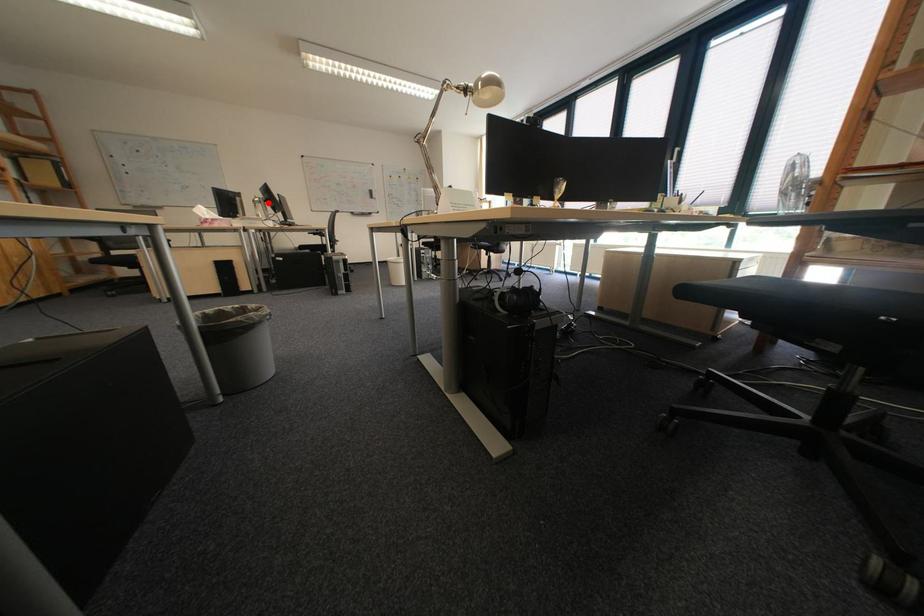
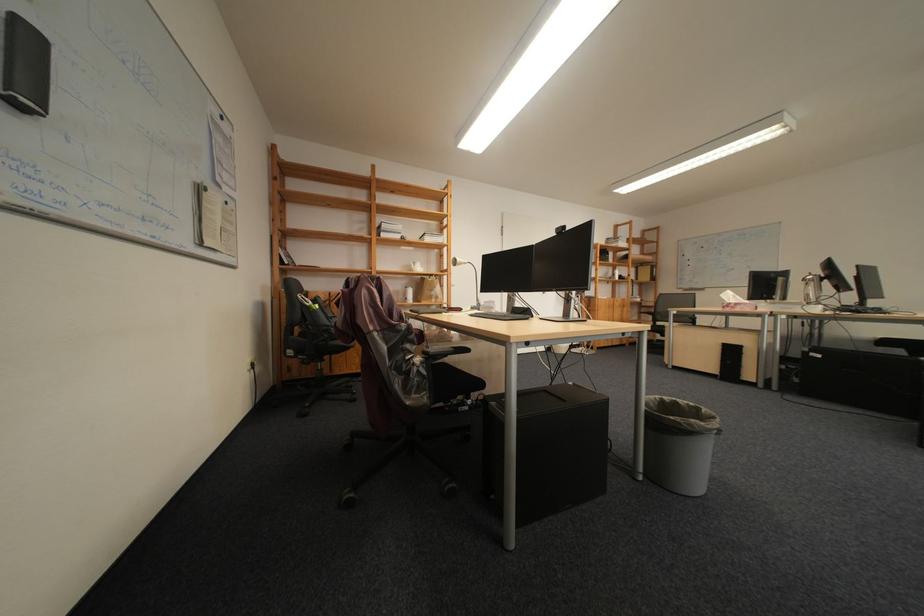
Locate, in the second image, the point that corresponds to the highlighted location in the first image.

(819, 282)